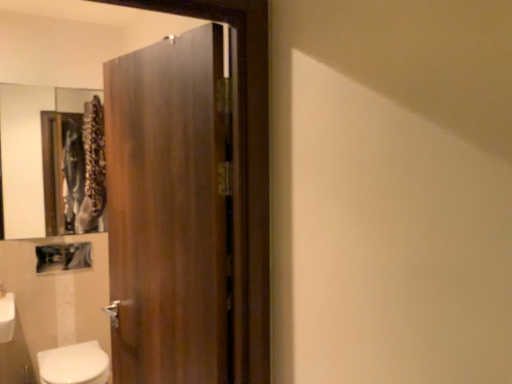
I want to click on white glossy bidet at lower left, so click(x=74, y=364).

At what (x,y) coordinates should I click in order to perform the action: click on white glossy bidet at lower left. Please return your answer as a coordinate pair (x, y). This screenshot has height=384, width=512. Looking at the image, I should click on (74, 364).

Between wooden door at center and white glossy bidet at lower left, which one has less height?

With less height is white glossy bidet at lower left.

Is wooden door at center positioned with its back to white glossy bidet at lower left?

wooden door at center does not have its back to white glossy bidet at lower left.

The image size is (512, 384). What are the coordinates of `bidet that is under the wooden door at center (from a real-world perspective)` in the screenshot? It's located at (74, 364).

Considering the relative positions of wooden door at center and white glossy bidet at lower left in the image provided, is wooden door at center behind white glossy bidet at lower left?

That is False.

Is wooden frame mirror at upper left at the left side of white glossy bidet at lower left?

Correct, you'll find wooden frame mirror at upper left to the left of white glossy bidet at lower left.

From the image's perspective, which is below, wooden frame mirror at upper left or white glossy bidet at lower left?

white glossy bidet at lower left, from the image's perspective.

Is wooden frame mirror at upper left touching white glossy bidet at lower left?

wooden frame mirror at upper left is not next to white glossy bidet at lower left, and they're not touching.

In terms of width, does wooden frame mirror at upper left look wider or thinner when compared to white glossy bidet at lower left?

Considering their sizes, wooden frame mirror at upper left looks slimmer than white glossy bidet at lower left.

Would you say white glossy bidet at lower left is to the left or to the right of wooden door at center in the picture?

From the image, it's evident that white glossy bidet at lower left is to the left of wooden door at center.

From the image's perspective, between white glossy bidet at lower left and wooden door at center, which one is located above?

wooden door at center, from the image's perspective.

Find the location of a particular element. The image size is (512, 384). bidet located underneath the wooden door at center (from a real-world perspective) is located at coordinates (74, 364).

Is point (97, 353) less distant than point (175, 260)?

No, (97, 353) is further to viewer.

Consider the image. Considering the relative sizes of wooden frame mirror at upper left and wooden door at center in the image provided, is wooden frame mirror at upper left bigger than wooden door at center?

Actually, wooden frame mirror at upper left might be smaller than wooden door at center.

Image resolution: width=512 pixels, height=384 pixels. Identify the location of door on the right of wooden frame mirror at upper left. (168, 210).

Can you tell me how much wooden frame mirror at upper left and wooden door at center differ in facing direction?

The angular difference between wooden frame mirror at upper left and wooden door at center is 74 degrees.

Which is in front, wooden frame mirror at upper left or wooden door at center?

wooden door at center is in front.

Is white glossy bidet at lower left far away from wooden frame mirror at upper left?

Yes, white glossy bidet at lower left and wooden frame mirror at upper left are located far from each other.

Which of these two, white glossy bidet at lower left or wooden frame mirror at upper left, is smaller?

Smaller between the two is wooden frame mirror at upper left.

Considering the positions of objects white glossy bidet at lower left and wooden frame mirror at upper left in the image provided, who is more to the right, white glossy bidet at lower left or wooden frame mirror at upper left?

white glossy bidet at lower left.

How different are the orientations of white glossy bidet at lower left and wooden frame mirror at upper left in degrees?

There is a 1.54-degree angle between the facing directions of white glossy bidet at lower left and wooden frame mirror at upper left.

Is point (183, 220) positioned after point (24, 192)?

No, it is in front of (24, 192).

Considering the sizes of objects wooden door at center and wooden frame mirror at upper left in the image provided, who is taller, wooden door at center or wooden frame mirror at upper left?

With more height is wooden door at center.

From the image's perspective, which is above, wooden door at center or wooden frame mirror at upper left?

wooden frame mirror at upper left.

Which is more to the left, wooden door at center or wooden frame mirror at upper left?

wooden frame mirror at upper left.

Image resolution: width=512 pixels, height=384 pixels. In order to click on door that appears above the white glossy bidet at lower left (from a real-world perspective) in this screenshot , I will do `click(168, 210)`.

This screenshot has height=384, width=512. Identify the location of bidet that appears in front of the wooden frame mirror at upper left. (74, 364).

Considering their positions, is wooden frame mirror at upper left positioned closer to wooden door at center than white glossy bidet at lower left?

white glossy bidet at lower left is positioned closer to the anchor wooden door at center.

Estimate the real-world distances between objects in this image. Which object is further from wooden frame mirror at upper left, white glossy bidet at lower left or wooden door at center?

Among the two, wooden door at center is located further to wooden frame mirror at upper left.

From the image, which object appears to be nearer to white glossy bidet at lower left, wooden frame mirror at upper left or wooden door at center?

wooden door at center lies closer to white glossy bidet at lower left than the other object.

Estimate the real-world distances between objects in this image. Which object is closer to wooden frame mirror at upper left, wooden door at center or white glossy bidet at lower left?

white glossy bidet at lower left.

From the picture: Which object lies further to the anchor point wooden door at center, white glossy bidet at lower left or wooden frame mirror at upper left?

wooden frame mirror at upper left lies further to wooden door at center than the other object.

Considering their positions, is wooden door at center positioned further to white glossy bidet at lower left than wooden frame mirror at upper left?

wooden frame mirror at upper left.

The height and width of the screenshot is (384, 512). Find the location of `door between wooden frame mirror at upper left and white glossy bidet at lower left vertically`. door between wooden frame mirror at upper left and white glossy bidet at lower left vertically is located at coordinates (168, 210).